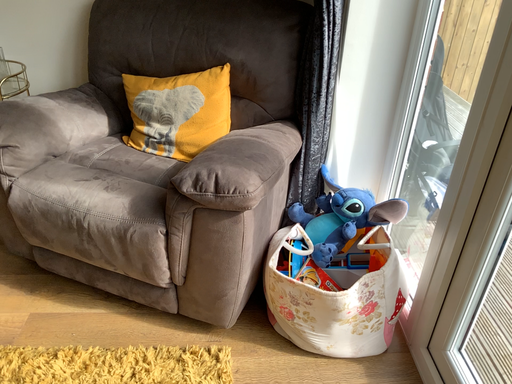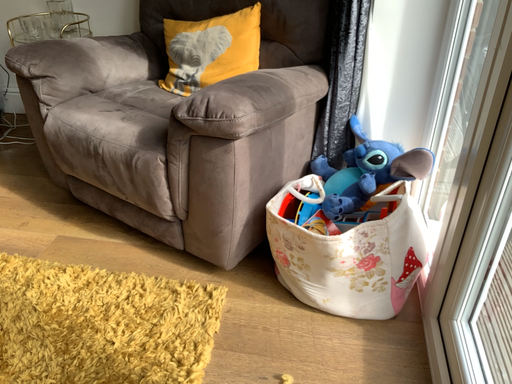
Question: Which way did the camera rotate in the video?

Choices:
 (A) rotated left
 (B) rotated right

Answer: (A)